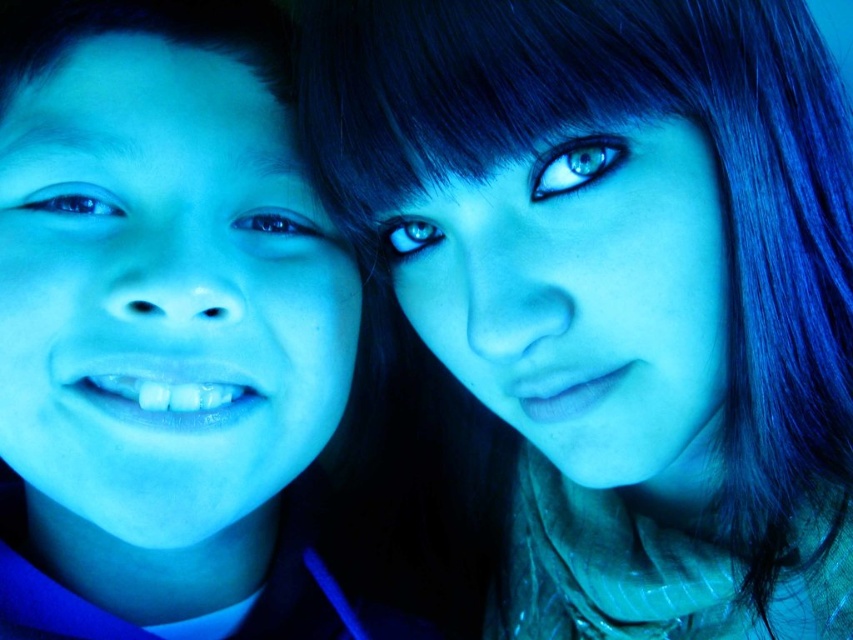
Question: From the image, what is the correct spatial relationship of blue matte hair at upper right in relation to matte blue face at left?

Choices:
 (A) below
 (B) above

Answer: (B)

Question: Can you confirm if blue matte hair at upper right is thinner than matte blue face at left?

Choices:
 (A) no
 (B) yes

Answer: (A)

Question: Can you confirm if blue matte hair at upper right is positioned above matte blue face at left?

Choices:
 (A) no
 (B) yes

Answer: (B)

Question: Which point is closer to the camera?

Choices:
 (A) matte blue face at left
 (B) blue matte hair at upper right

Answer: (B)